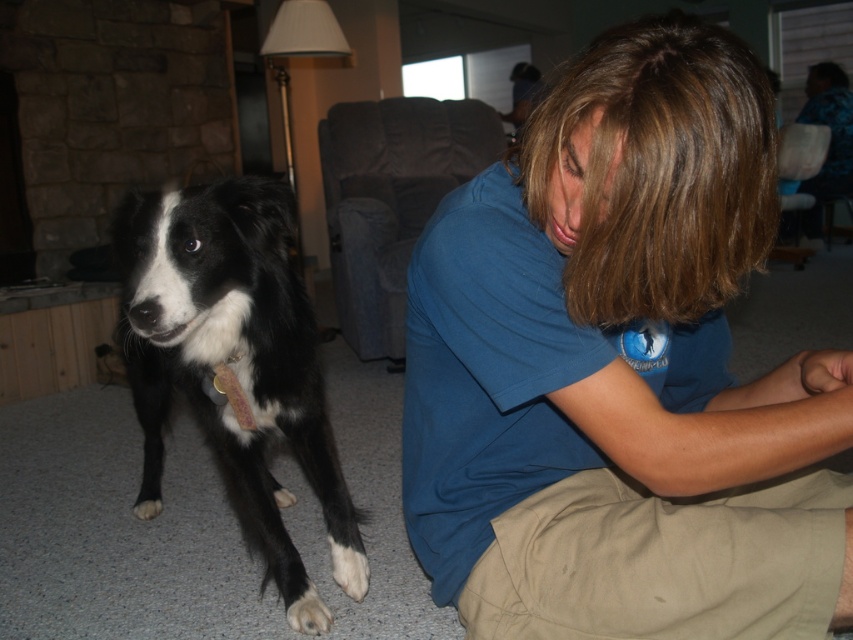
Question: Does black and white fur at left have a greater width compared to white fur at lower left?

Choices:
 (A) yes
 (B) no

Answer: (A)

Question: Which of these objects is positioned closest to the black and white fur at left?

Choices:
 (A) blue cotton shirt at lower right
 (B) white fur at lower left

Answer: (B)

Question: Which object is the closest to the blue cotton shirt at lower right?

Choices:
 (A) black and white fur at left
 (B) white fur at lower left

Answer: (A)

Question: Is blue cotton shirt at lower right above white fur at lower left?

Choices:
 (A) yes
 (B) no

Answer: (A)

Question: Among these objects, which one is farthest from the camera?

Choices:
 (A) blue cotton shirt at lower right
 (B) white fur at lower left

Answer: (B)

Question: Can you confirm if blue cotton shirt at lower right is wider than white fur at lower left?

Choices:
 (A) no
 (B) yes

Answer: (B)